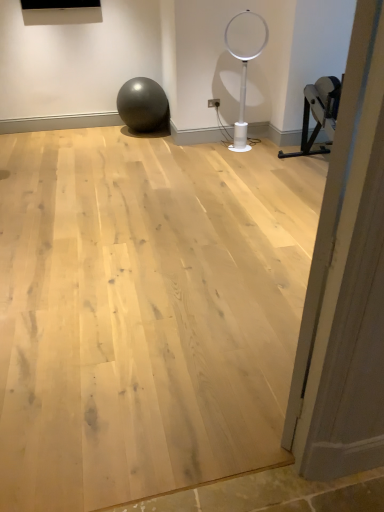
Locate an element on the screen. This screenshot has height=512, width=384. vacant area that is in front of white plastic basketball hoop at center is located at coordinates (251, 154).